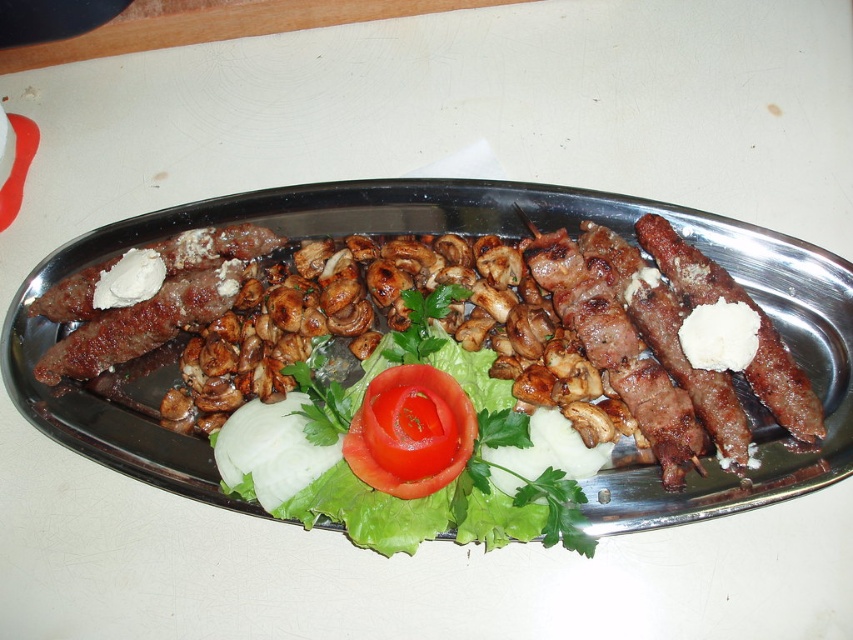
Who is taller, brown grilled skewers at center or red smooth tomato at center?

brown grilled skewers at center

Can you confirm if brown grilled skewers at center is smaller than red smooth tomato at center?

Actually, brown grilled skewers at center might be larger than red smooth tomato at center.

Is point (764, 243) in front of point (358, 461)?

No.

At what (x,y) coordinates should I click in order to perform the action: click on brown grilled skewers at center. Please return your answer as a coordinate pair (x, y). The image size is (853, 640). Looking at the image, I should click on (469, 232).

Who is shorter, red glossy tomato at center or red smooth tomato at center?

With less height is red smooth tomato at center.

Looking at this image, which of these two, red glossy tomato at center or red smooth tomato at center, stands taller?

Standing taller between the two is red glossy tomato at center.

Is point (427, 424) closer to camera compared to point (410, 385)?

That is True.

This screenshot has height=640, width=853. I want to click on red glossy tomato at center, so click(404, 449).

Can you confirm if brown grilled skewers at center is smaller than brown grilled sausage at right?

No, brown grilled skewers at center is not smaller than brown grilled sausage at right.

Who is positioned more to the right, brown grilled skewers at center or brown grilled sausage at right?

Positioned to the right is brown grilled sausage at right.

Is point (624, 484) positioned before point (688, 292)?

Yes, it is in front of point (688, 292).

I want to click on brown grilled skewers at center, so click(469, 232).